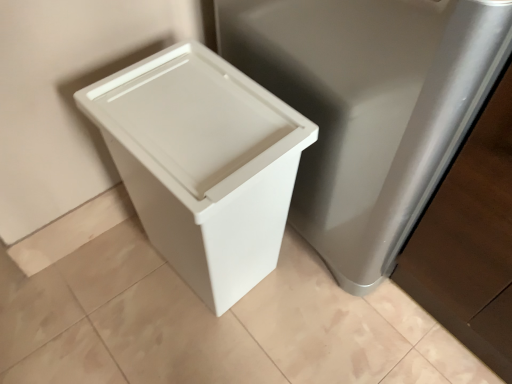
Where is `vacant space in front of beige wood baseboard at lower left`? The width and height of the screenshot is (512, 384). vacant space in front of beige wood baseboard at lower left is located at coordinates (73, 299).